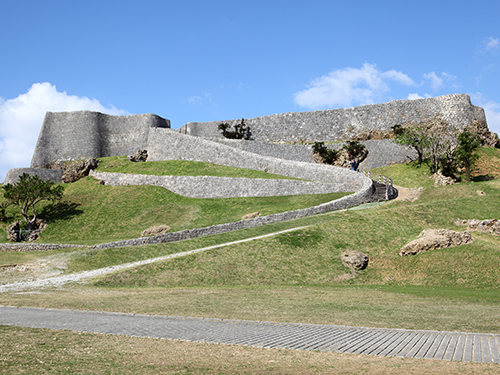
The height and width of the screenshot is (375, 500). I want to click on stair railing, so click(391, 181).